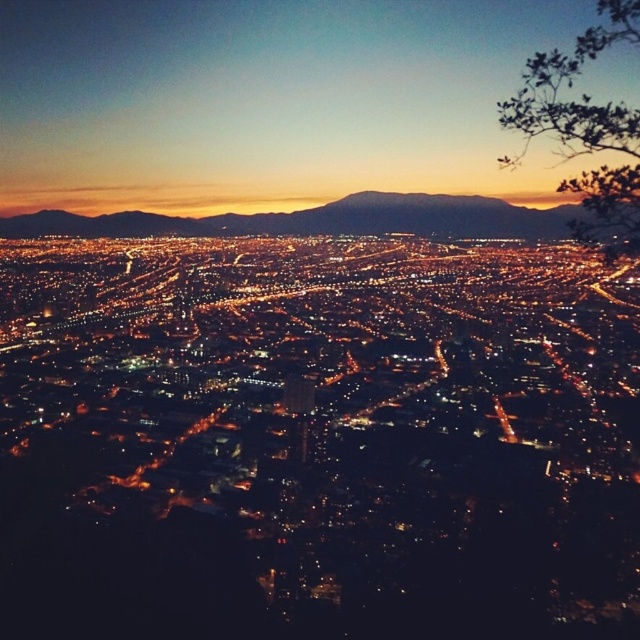
In the scene shown: Does matte orange sky at upper center lie behind dark brown mountain at center?

Yes.

Is point (282, 150) farther from camera compared to point (497, 234)?

No, (282, 150) is in front of (497, 234).

The height and width of the screenshot is (640, 640). What are the coordinates of `matte orange sky at upper center` in the screenshot? It's located at coord(269,100).